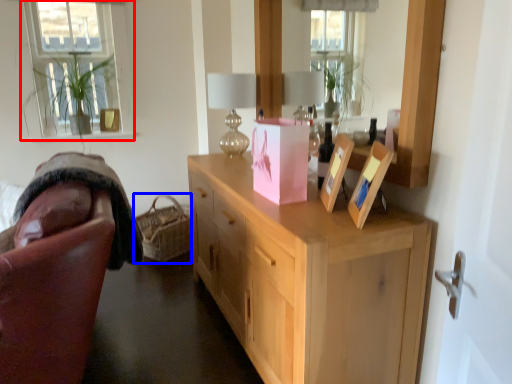
Question: Which point is further to the camera, window (highlighted by a red box) or basket (highlighted by a blue box)?

Choices:
 (A) window
 (B) basket

Answer: (A)